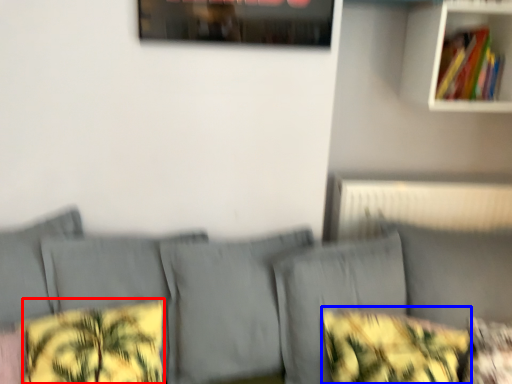
Question: Which object appears farthest to the camera in this image, pillow (highlighted by a red box) or throw pillow (highlighted by a blue box)?

Choices:
 (A) pillow
 (B) throw pillow

Answer: (B)